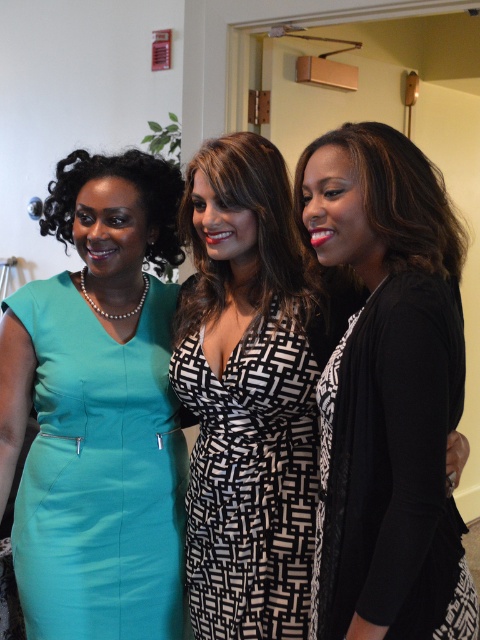
You are standing in a room where three women are positioned as described. You need to locate the black matte cardigan at right. According to the coordinates given, where exactly is it positioned?

The black matte cardigan at right is positioned at coordinates point [387,392].

You are a photographer standing at the center of the room. You want to take a photo of the teal matte dress at left. Where should you position yourself to capture the dress in the frame?

The teal matte dress at left is located at point 2D coordinates (99,472), so you should position yourself to the left side of the room to capture the dress in the frame.